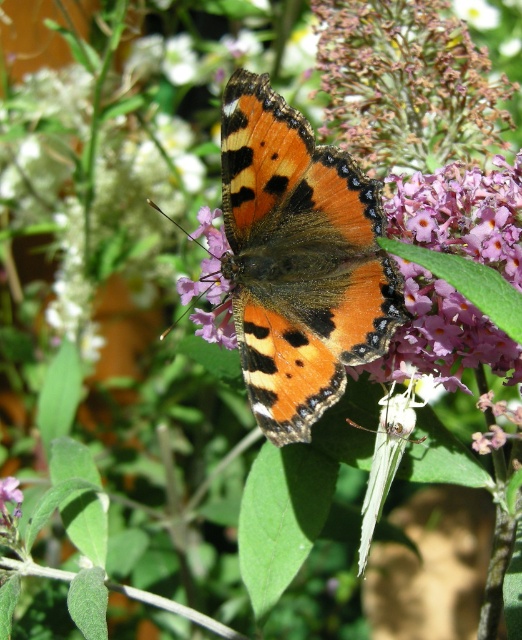
Question: Which object is farther from the camera taking this photo?

Choices:
 (A) orange matte butterfly at center
 (B) purple matte flower at center

Answer: (B)

Question: Is orange matte butterfly at center wider than purple matte flower at center?

Choices:
 (A) no
 (B) yes

Answer: (B)

Question: Can you confirm if orange matte butterfly at center is bigger than purple matte flower at center?

Choices:
 (A) yes
 (B) no

Answer: (A)

Question: Does orange matte butterfly at center have a lesser width compared to purple matte flower at center?

Choices:
 (A) yes
 (B) no

Answer: (B)

Question: Which object is closer to the camera taking this photo?

Choices:
 (A) purple matte flower at center
 (B) orange matte butterfly at center

Answer: (B)